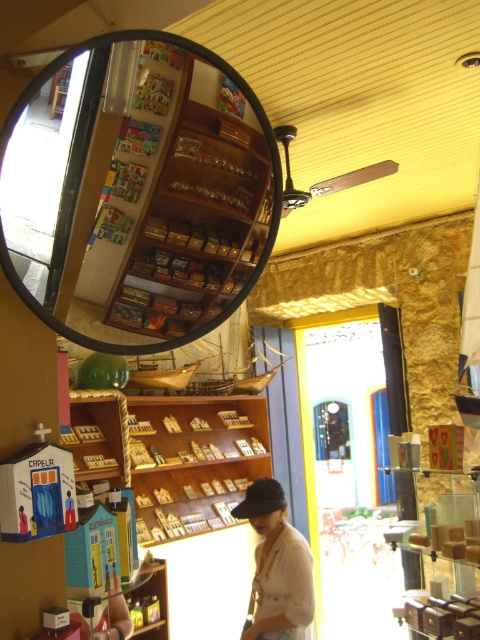
You are a customer in the shop and want to pick up the white cotton shirt at lower center. Can you reach it without moving the wooden shelves at center?

The wooden shelves at center is in front of the white cotton shirt at lower center, so you cannot reach the white cotton shirt at lower center without moving the wooden shelves at center.

You are standing at the point marked as point (275,180) in the shop. You want to reach the blue frame of the bright yellow door. Can you walk directly to it without moving around any obstacles?

The distance between you and the blue frame of the bright yellow door is 3.71 feet, so yes, you can walk directly to it without needing to move around any obstacles since there is enough space.